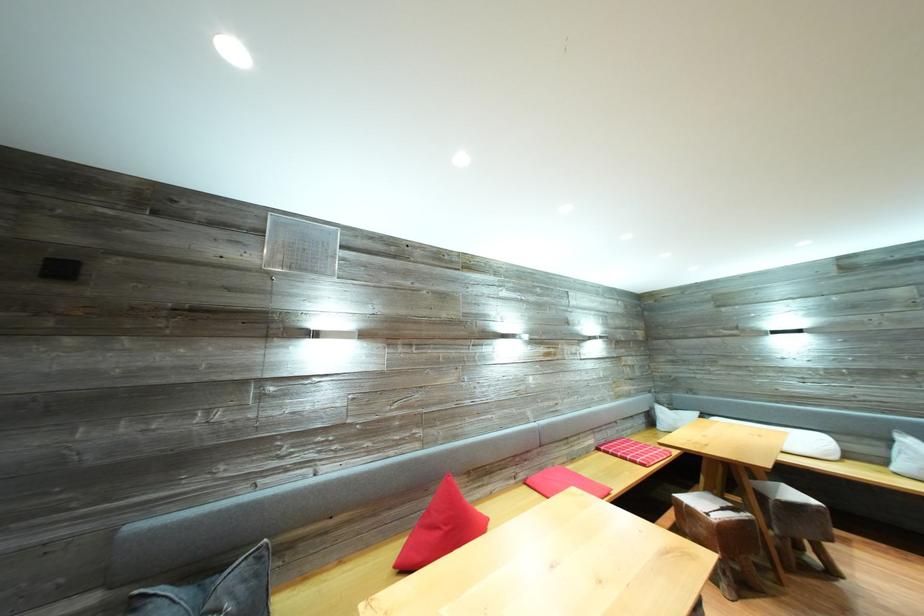
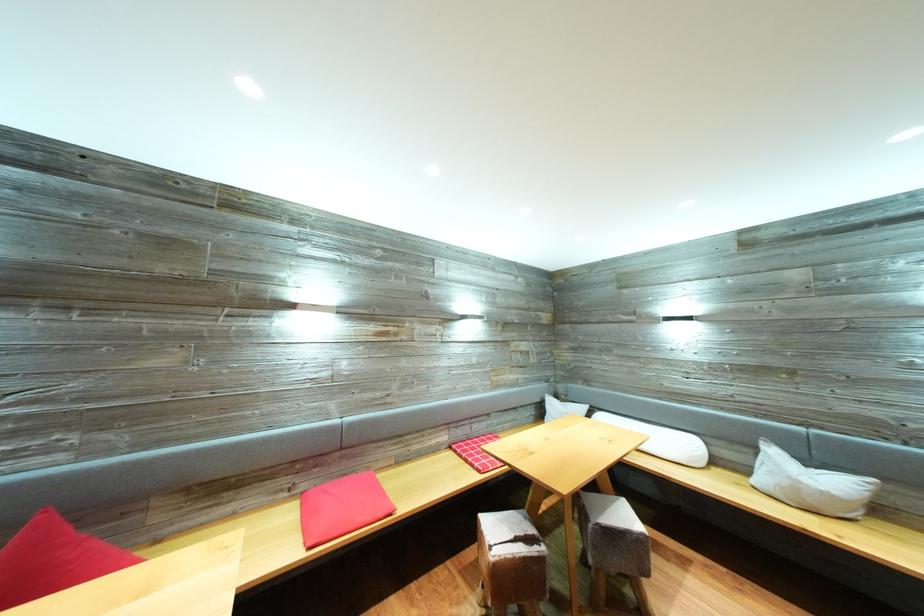
What movement of the cameraman would produce the second image?

The cameraman walked toward right, forward.